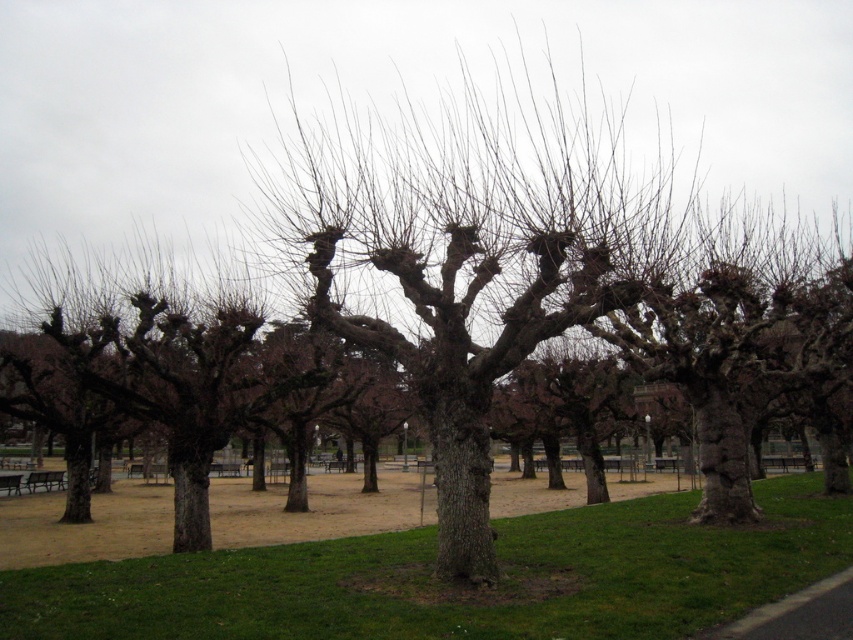
You are standing in the park and want to walk from the point at coordinates point [518,100] to the point at coordinates point [136,572]. Which direction should you move to get closer to your destination?

You should move towards the lower right direction because point [136,572] is closer to the viewer than point [518,100], so moving in that direction will bring you closer to the destination.

You are a gardener who wants to plant a new flower bed between the bark textured tree at center and the green grass at lower center. Based on their positions, where should the flower bed be placed?

The green grass at lower center is behind the bark textured tree at center, so the flower bed should be placed in front of the bark textured tree at center and in front of the green grass at lower center.

You are a gardener who needs to water the green grass at lower center and the bark textured tree at center. Which object is located to the left of the other?

The bark textured tree at center is to the left of green grass at lower center.